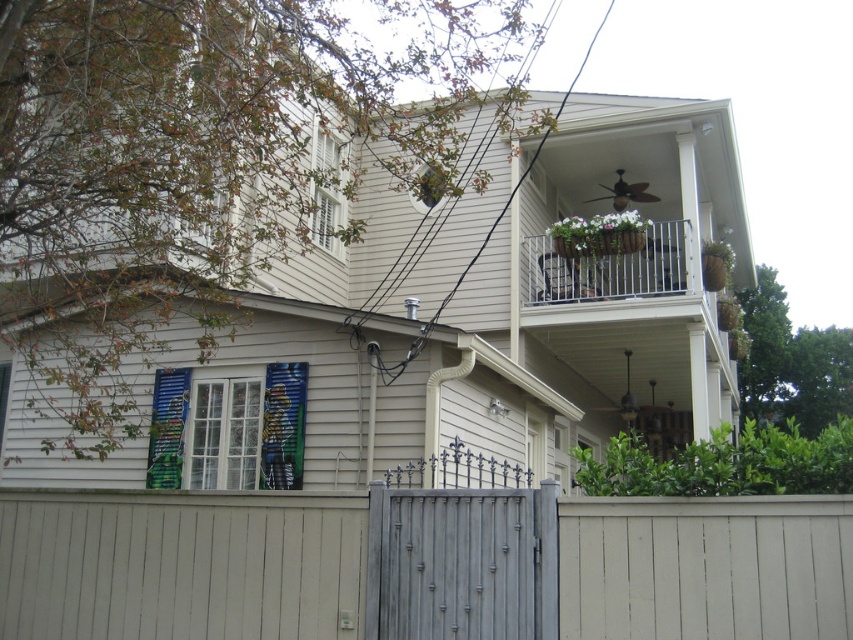
Does point (299, 442) come behind point (323, 172)?

No, it is in front of (323, 172).

Is point (300, 458) positioned after point (337, 227)?

That is False.

Find the location of a particular element. painted wood shutter at lower left is located at coordinates click(250, 429).

Is painted wood shutter at lower left wider than white metal railing at upper center?

No.

Does painted wood shutter at lower left appear on the right side of white metal railing at upper center?

In fact, painted wood shutter at lower left is to the left of white metal railing at upper center.

This screenshot has width=853, height=640. What are the coordinates of `painted wood shutter at lower left` in the screenshot? It's located at pyautogui.click(x=250, y=429).

You are a GUI agent. You are given a task and a screenshot of the screen. Output one action in this format:
    pyautogui.click(x=<x>, y=<y>)
    Task: Click on the painted wood shutter at lower left
    
    Given the screenshot: What is the action you would take?
    [x=250, y=429]

In the scene shown: Who is positioned more to the left, white metal railing at upper center or green matte shutter at upper center?

green matte shutter at upper center

Which is behind, point (663, 276) or point (338, 186)?

The point (663, 276) is behind.

You are a GUI agent. You are given a task and a screenshot of the screen. Output one action in this format:
    pyautogui.click(x=<x>, y=<y>)
    Task: Click on the white metal railing at upper center
    This screenshot has height=640, width=853.
    Given the screenshot: What is the action you would take?
    pyautogui.click(x=608, y=268)